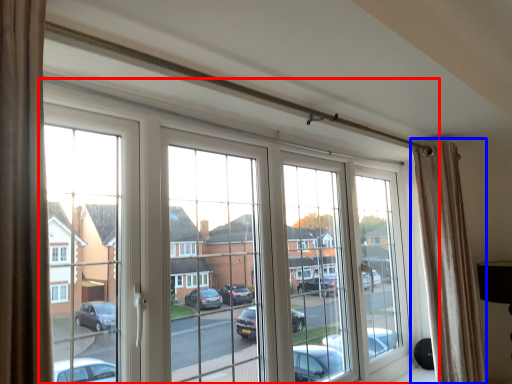
Question: Which object appears closest to the camera in this image, window (highlighted by a red box) or curtain (highlighted by a blue box)?

Choices:
 (A) window
 (B) curtain

Answer: (A)